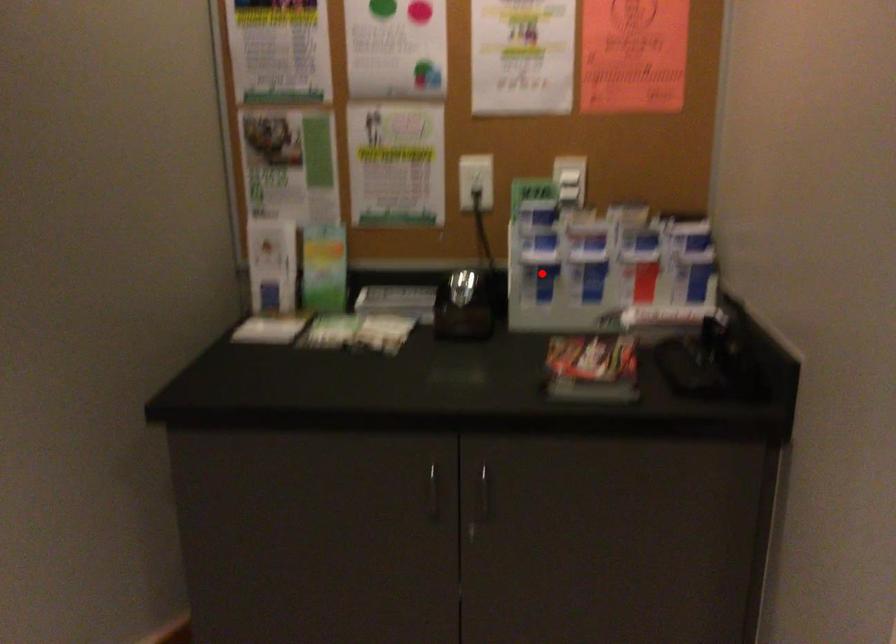
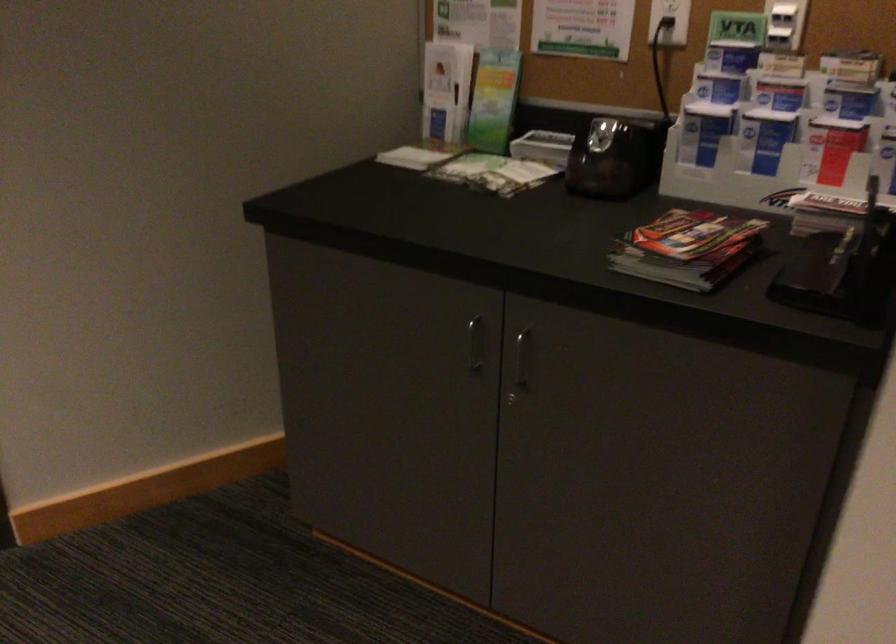
Find the pixel in the second image that matches the highlighted location in the first image.

(702, 131)